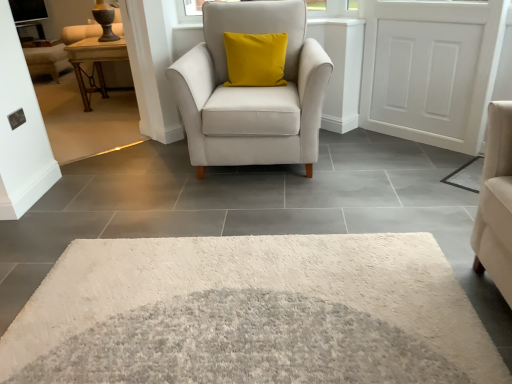
The height and width of the screenshot is (384, 512). What do you see at coordinates (94, 63) in the screenshot? I see `woodenwoodentable at left` at bounding box center [94, 63].

I want to click on white shaggy rug at lower right, so click(x=467, y=175).

What is the approximate width of white shaggy rug at lower right?

white shaggy rug at lower right is 20.10 inches wide.

In order to click on transparent glass window screen at upper left in this screenshot , I will do `click(28, 10)`.

Are white shaggy rug at lower right and woodenwoodentable at left located far from each other?

white shaggy rug at lower right is positioned a significant distance from woodenwoodentable at left.

Can we say white shaggy rug at lower right lies outside woodenwoodentable at left?

Yes, white shaggy rug at lower right is not within woodenwoodentable at left.

Between white shaggy rug at lower right and woodenwoodentable at left, which one has more height?

woodenwoodentable at left is taller.

Is matte brown wooden couch at upper left far away from transparent glass window screen at upper left?

Yes, matte brown wooden couch at upper left and transparent glass window screen at upper left are quite far apart.

How different are the orientations of matte brown wooden couch at upper left and transparent glass window screen at upper left in degrees?

145 degrees.

Considering the relative sizes of matte brown wooden couch at upper left and transparent glass window screen at upper left in the image provided, is matte brown wooden couch at upper left taller than transparent glass window screen at upper left?

Indeed, matte brown wooden couch at upper left has a greater height compared to transparent glass window screen at upper left.

Could you tell me if matte brown wooden couch at upper left is turned towards transparent glass window screen at upper left?

No, matte brown wooden couch at upper left is not aimed at transparent glass window screen at upper left.

In the scene shown: Which of these two, white wood door at upper right or white shaggy rug at lower right, is smaller?

Smaller between the two is white shaggy rug at lower right.

Which point is more distant from viewer, (382, 7) or (479, 163)?

The point (382, 7) is farther.

Can you confirm if white wood door at upper right is shorter than woodenwoodentable at left?

No, white wood door at upper right is not shorter than woodenwoodentable at left.

Is point (446, 72) closer or farther from the camera than point (73, 51)?

Point (446, 72) is closer to the camera than point (73, 51).

Which object is positioned more to the left, white wood door at upper right or woodenwoodentable at left?

Positioned to the left is woodenwoodentable at left.

Which of these two, white wood door at upper right or woodenwoodentable at left, is wider?

woodenwoodentable at left is wider.

Based on their positions, is matte white armchair at center located to the left or right of transparent glass window screen at upper left?

From the image, it's evident that matte white armchair at center is to the right of transparent glass window screen at upper left.

How distant is matte white armchair at center from transparent glass window screen at upper left?

matte white armchair at center is 14.71 feet away from transparent glass window screen at upper left.

Which point is more forward, (306, 94) or (32, 1)?

The point (306, 94) is closer.

Considering the sizes of objects matte white armchair at center and transparent glass window screen at upper left in the image provided, who is taller, matte white armchair at center or transparent glass window screen at upper left?

matte white armchair at center.

Is matte white armchair at center not close to matte brown wooden couch at upper left?

matte white armchair at center is positioned a significant distance from matte brown wooden couch at upper left.

How distant is matte white armchair at center from matte brown wooden couch at upper left?

A distance of 1.89 meters exists between matte white armchair at center and matte brown wooden couch at upper left.

From the picture: From the image's perspective, relative to matte brown wooden couch at upper left, is matte white armchair at center above or below?

matte white armchair at center is situated lower than matte brown wooden couch at upper left in the image.

Considering the relative sizes of matte white armchair at center and matte brown wooden couch at upper left in the image provided, is matte white armchair at center thinner than matte brown wooden couch at upper left?

Incorrect, the width of matte white armchair at center is not less than that of matte brown wooden couch at upper left.

Is matte white armchair at center located within white shaggy rug at lower right?

No, matte white armchair at center is not a part of white shaggy rug at lower right.

Considering the points (478, 161) and (269, 140), which point is behind, point (478, 161) or point (269, 140)?

The point (478, 161) is behind.

From a real-world perspective, is white shaggy rug at lower right under matte white armchair at center?

Correct, in the physical world, white shaggy rug at lower right is lower than matte white armchair at center.

Is white shaggy rug at lower right facing towards matte white armchair at center?

No, white shaggy rug at lower right is not facing towards matte white armchair at center.

You are a GUI agent. You are given a task and a screenshot of the screen. Output one action in this format:
    pyautogui.click(x=<x>, y=<y>)
    Task: Click on the table located on the left of white shaggy rug at lower right
    The width and height of the screenshot is (512, 384).
    Given the screenshot: What is the action you would take?
    pyautogui.click(x=94, y=63)

Find the location of a particular element. couch that is below the transparent glass window screen at upper left (from the image's perspective) is located at coordinates (81, 32).

Based on their spatial positions, is matte white armchair at center or woodenwoodentable at left further from white wood door at upper right?

woodenwoodentable at left lies further to white wood door at upper right than the other object.

Based on their spatial positions, is white shaggy rug at lower right or white wood door at upper right closer to matte brown wooden couch at upper left?

white wood door at upper right is closer to matte brown wooden couch at upper left.

Estimate the real-world distances between objects in this image. Which object is closer to woodenwoodentable at left, matte white armchair at center or white wood door at upper right?

matte white armchair at center lies closer to woodenwoodentable at left than the other object.

Considering their positions, is white shaggy rug at lower right positioned closer to woodenwoodentable at left than transparent glass window screen at upper left?

transparent glass window screen at upper left.

When comparing their distances from transparent glass window screen at upper left, does matte white armchair at center or matte brown wooden couch at upper left seem closer?

Based on the image, matte brown wooden couch at upper left appears to be nearer to transparent glass window screen at upper left.

From the image, which object appears to be nearer to woodenwoodentable at left, white shaggy rug at lower right or matte white armchair at center?

Among the two, matte white armchair at center is located nearer to woodenwoodentable at left.

Looking at the image, which one is located closer to matte brown wooden couch at upper left, matte white armchair at center or woodenwoodentable at left?

woodenwoodentable at left lies closer to matte brown wooden couch at upper left than the other object.

Considering their positions, is matte brown wooden couch at upper left positioned further to white shaggy rug at lower right than white wood door at upper right?

matte brown wooden couch at upper left is positioned further to the anchor white shaggy rug at lower right.

Locate an element on the screen. The width and height of the screenshot is (512, 384). door between matte white armchair at center and transparent glass window screen at upper left along the z-axis is located at coordinates (431, 70).

Find the location of a particular element. The height and width of the screenshot is (384, 512). table between matte white armchair at center and transparent glass window screen at upper left from front to back is located at coordinates (94, 63).

Locate an element on the screen. couch between transparent glass window screen at upper left and white shaggy rug at lower right in the horizontal direction is located at coordinates coord(81,32).

You are a GUI agent. You are given a task and a screenshot of the screen. Output one action in this format:
    pyautogui.click(x=<x>, y=<y>)
    Task: Click on the table between transparent glass window screen at upper left and white wood door at upper right from left to right
    The width and height of the screenshot is (512, 384).
    Given the screenshot: What is the action you would take?
    pyautogui.click(x=94, y=63)